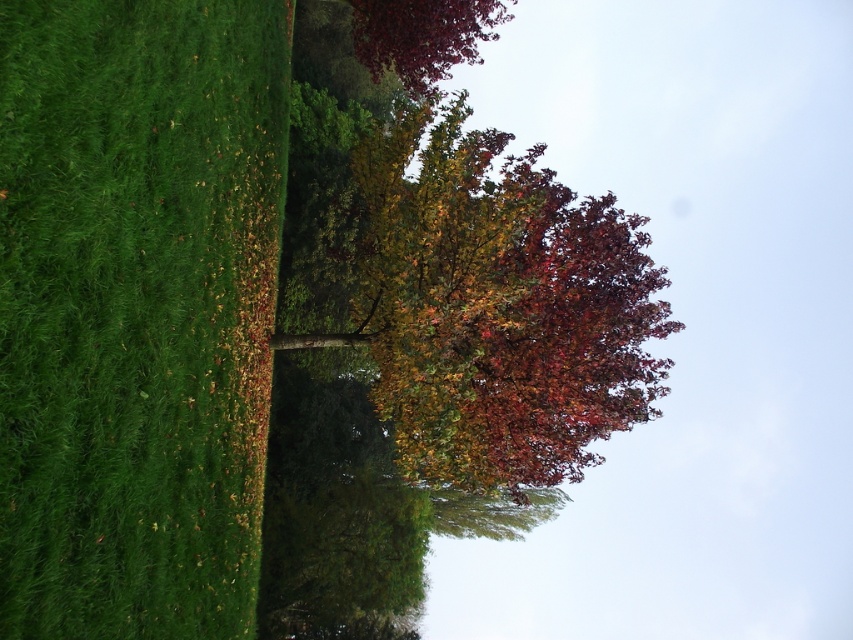
Question: Is multicolored foliage at center positioned before shiny burgundy leaves at upper center?

Choices:
 (A) no
 (B) yes

Answer: (B)

Question: Does green grassy hedge at left appear over multicolored foliage at center?

Choices:
 (A) no
 (B) yes

Answer: (A)

Question: Can you confirm if green grassy hedge at left is positioned to the right of shiny burgundy leaves at upper center?

Choices:
 (A) no
 (B) yes

Answer: (A)

Question: Which of the following is the farthest from the observer?

Choices:
 (A) (456, 44)
 (B) (547, 317)
 (C) (105, 314)

Answer: (A)

Question: Among these objects, which one is nearest to the camera?

Choices:
 (A) shiny burgundy leaves at upper center
 (B) multicolored foliage at center

Answer: (B)

Question: Which point appears farthest from the camera in this image?

Choices:
 (A) (259, 460)
 (B) (445, 177)

Answer: (B)